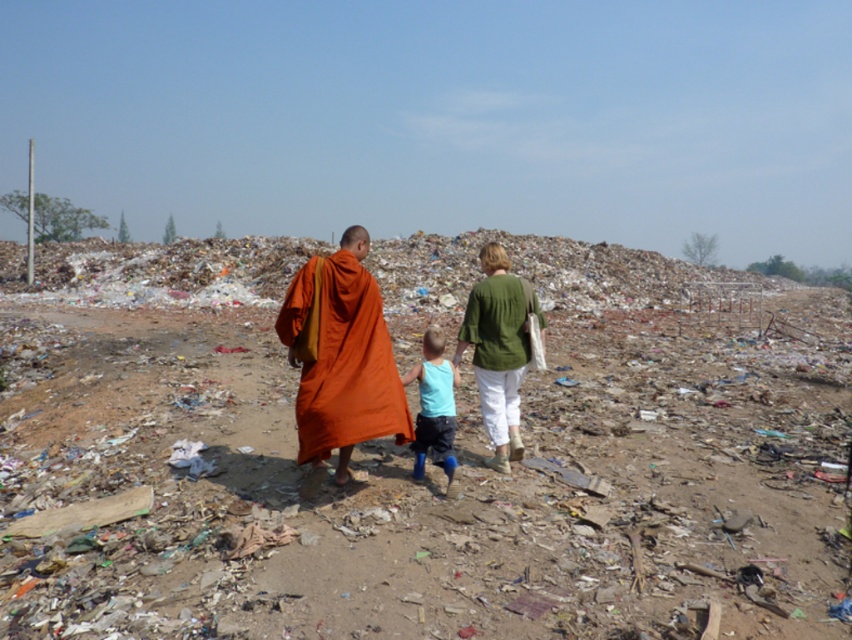
Question: Does orange cloth monk at center appear on the right side of light blue fabric at center?

Choices:
 (A) yes
 (B) no

Answer: (B)

Question: Considering the real-world distances, which object is closest to the light blue fabric shirt at center?

Choices:
 (A) orange cloth robe at center
 (B) light blue fabric at center

Answer: (B)

Question: Does light blue fabric shirt at center appear on the right side of light blue fabric at center?

Choices:
 (A) yes
 (B) no

Answer: (A)

Question: Estimate the real-world distances between objects in this image. Which object is closer to the light blue fabric at center?

Choices:
 (A) light blue fabric shirt at center
 (B) orange cloth robe at center

Answer: (A)

Question: Is orange cloth monk at center positioned behind light blue fabric at center?

Choices:
 (A) yes
 (B) no

Answer: (B)

Question: Which point appears farthest from the camera in this image?

Choices:
 (A) (459, 444)
 (B) (493, 390)
 (C) (452, 468)

Answer: (A)